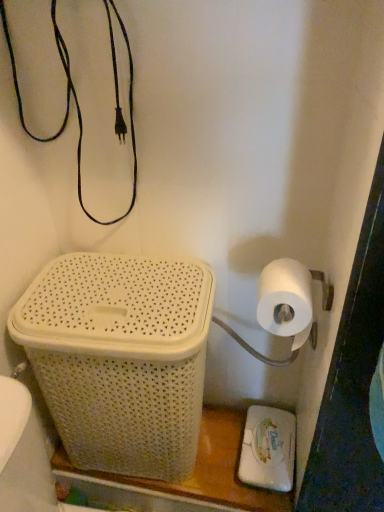
Question: In terms of size, does white matte toilet paper at right appear bigger or smaller than white wicker basket at lower left?

Choices:
 (A) big
 (B) small

Answer: (B)

Question: In the image, is white matte toilet paper at right positioned in front of or behind white wicker basket at lower left?

Choices:
 (A) behind
 (B) front

Answer: (B)

Question: Which object is the farthest from the white wicker basket at lower left?

Choices:
 (A) white matte toilet paper at right
 (B) white wicker basket at lower left

Answer: (A)

Question: Which object is positioned farthest from the white wicker basket at lower left?

Choices:
 (A) white matte toilet paper at right
 (B) white wicker basket at lower left

Answer: (A)